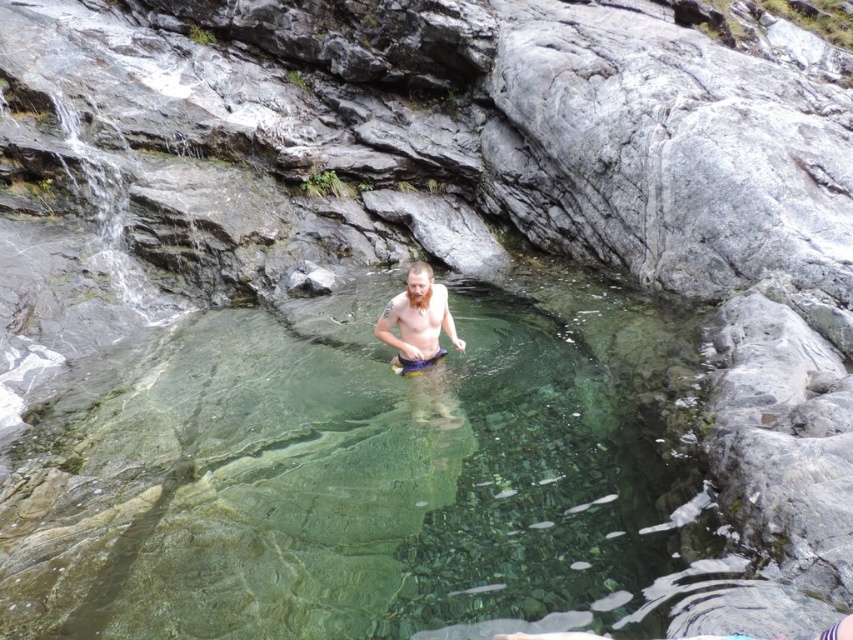
Consider the image. You are standing at the edge of the pool and want to toss a small pebble into the water. If you aim for the clear glassy water at center and the purple fabric shorts at center, which object will the pebble hit first?

The clear glassy water at center is closer to the viewer than the purple fabric shorts at center, so the pebble will hit the clear glassy water at center first.

You are standing on the edge of the natural pool and want to jump into the clear glassy water at center. According to the coordinates provided, where exactly should you aim to land?

You should aim for the coordinates point at (326, 483) to land in the clear glassy water at center.

You are standing at the edge of the pool and want to toss a small pebble into the water. Considering the clear glassy water at center and the purple fabric shorts at center, which one is wider?

The clear glassy water at center is wider than the purple fabric shorts at center.